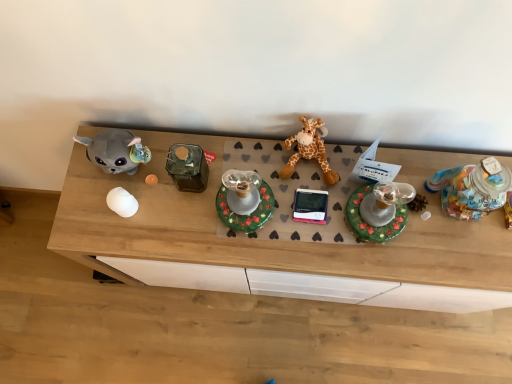
Question: Is orange plush giraffe at center spatially inside green matte candle holder at center, placed as the second toy when sorted from left to right, or outside of it?

Choices:
 (A) inside
 (B) outside

Answer: (B)

Question: In the image, is orange plush giraffe at center on the left side or the right side of green matte candle holder at center, which is the third toy from right to left?

Choices:
 (A) right
 (B) left

Answer: (A)

Question: Which of these objects is positioned farthest from the green matte candle holder at center, placed as the second toy when sorted from left to right?

Choices:
 (A) wooden desk at center
 (B) white glossy egg at center, acting as the 4th toy starting from the right
 (C) translucent plastic jar at right, positioned as the first toy in right-to-left order
 (D) shiny green plastic candle holder at center, which appears as the second toy when viewed from the right
 (E) orange plush giraffe at center

Answer: (C)

Question: Estimate the real-world distances between objects in this image. Which object is farther from the white glossy egg at center, which is the first toy from left to right?

Choices:
 (A) translucent plastic jar at right, positioned as the first toy in right-to-left order
 (B) orange plush giraffe at center
 (C) wooden desk at center
 (D) green matte candle holder at center, which is the third toy from right to left
 (E) shiny green plastic candle holder at center, which appears as the second toy when viewed from the right

Answer: (A)